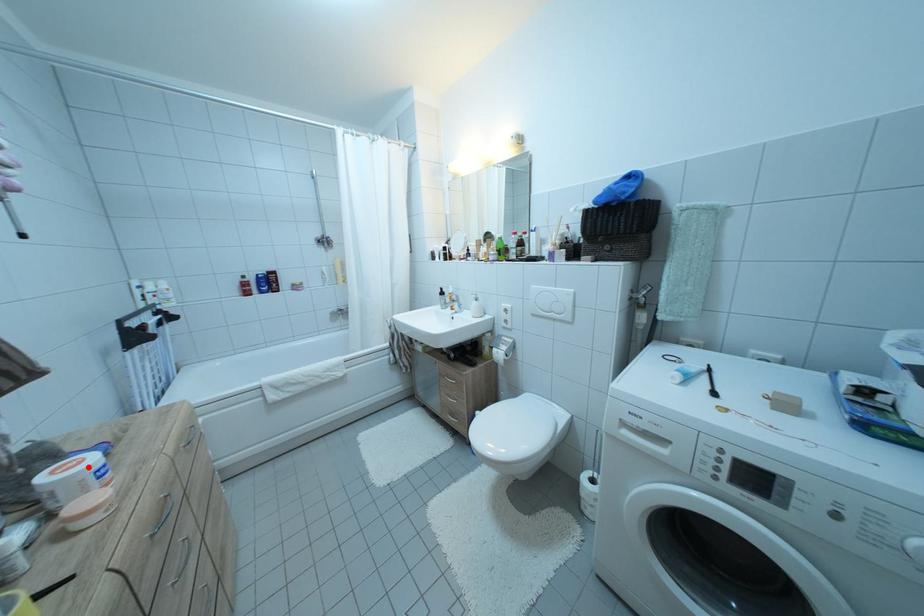
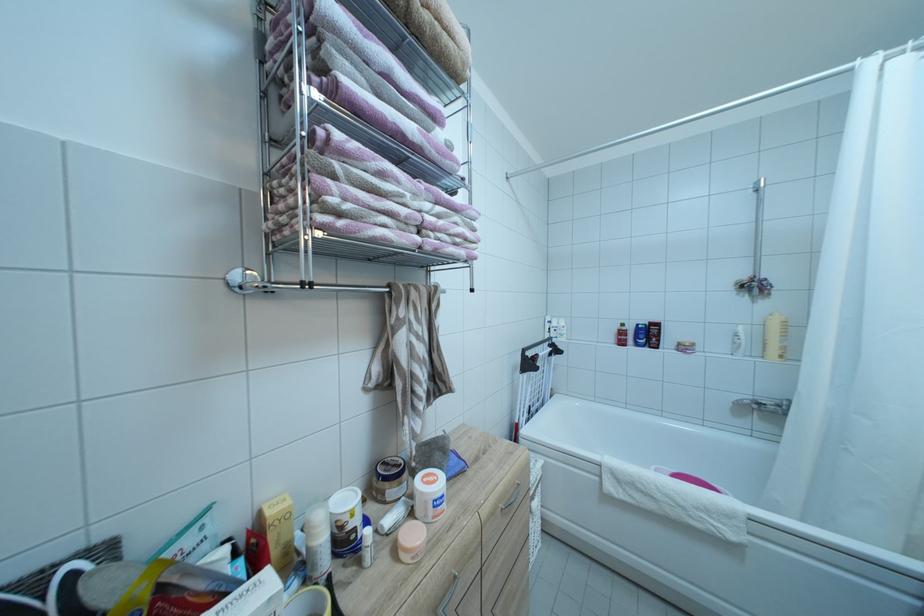
Question: I am providing you with two images of the same scene from different viewpoints. A red point is marked on the first image. At the location where the point appears in image 1, is it still visible in image 2?

Choices:
 (A) Yes
 (B) No

Answer: (A)